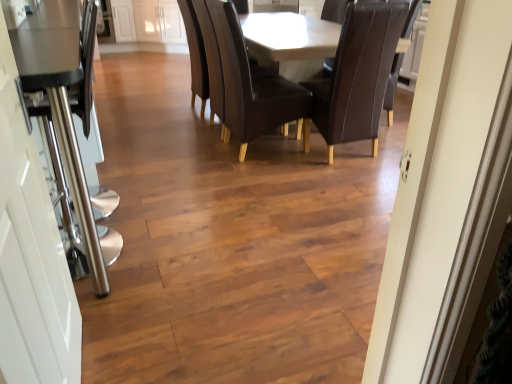
In order to click on free spot in front of brown leather chair at center, the 2th chair when ordered from left to right in this screenshot , I will do `click(341, 180)`.